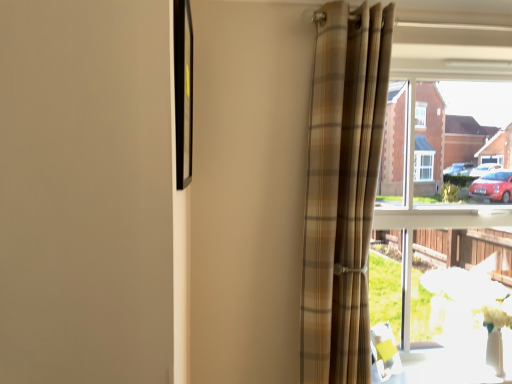
Question: Is clear glass window at right oriented away from black glossy picture frame at upper left?

Choices:
 (A) yes
 (B) no

Answer: (B)

Question: From the image's perspective, is clear glass window at right located beneath black glossy picture frame at upper left?

Choices:
 (A) yes
 (B) no

Answer: (A)

Question: Does clear glass window at right have a larger size compared to black glossy picture frame at upper left?

Choices:
 (A) no
 (B) yes

Answer: (B)

Question: Does clear glass window at right appear on the left side of black glossy picture frame at upper left?

Choices:
 (A) no
 (B) yes

Answer: (A)

Question: From a real-world perspective, is clear glass window at right located beneath black glossy picture frame at upper left?

Choices:
 (A) yes
 (B) no

Answer: (A)

Question: Considering the positions of plaid fabric curtain at right and white glossy table at lower right in the image, is plaid fabric curtain at right taller or shorter than white glossy table at lower right?

Choices:
 (A) tall
 (B) short

Answer: (A)

Question: From the image's perspective, is plaid fabric curtain at right above or below white glossy table at lower right?

Choices:
 (A) below
 (B) above

Answer: (B)

Question: Is plaid fabric curtain at right inside the boundaries of white glossy table at lower right, or outside?

Choices:
 (A) outside
 (B) inside

Answer: (A)

Question: Is plaid fabric curtain at right in front of or behind white glossy table at lower right in the image?

Choices:
 (A) front
 (B) behind

Answer: (A)

Question: In the image, is clear glass window at right positioned in front of or behind white glossy table at lower right?

Choices:
 (A) behind
 (B) front

Answer: (A)

Question: Considering the positions of clear glass window at right and white glossy table at lower right in the image, is clear glass window at right wider or thinner than white glossy table at lower right?

Choices:
 (A) thin
 (B) wide

Answer: (A)

Question: Considering the positions of clear glass window at right and white glossy table at lower right in the image, is clear glass window at right bigger or smaller than white glossy table at lower right?

Choices:
 (A) big
 (B) small

Answer: (A)

Question: Which is correct: clear glass window at right is inside white glossy table at lower right, or outside of it?

Choices:
 (A) outside
 (B) inside

Answer: (A)

Question: Does point (417, 359) appear closer or farther from the camera than point (184, 69)?

Choices:
 (A) farther
 (B) closer

Answer: (A)

Question: Considering the positions of white glossy table at lower right and black glossy picture frame at upper left in the image, is white glossy table at lower right wider or thinner than black glossy picture frame at upper left?

Choices:
 (A) wide
 (B) thin

Answer: (A)